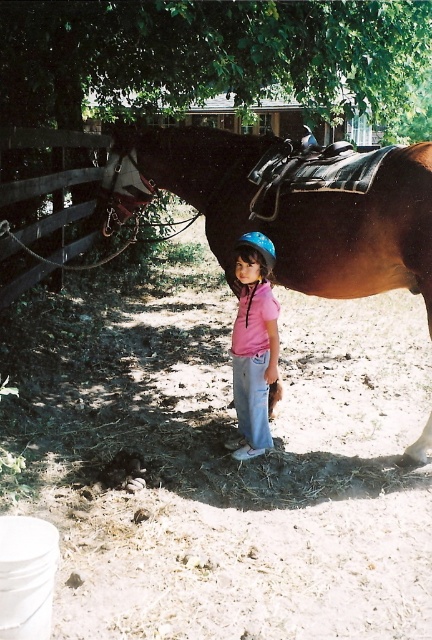
You are a drone operator who needs to capture a photo of the green leafy tree at upper center from the current camera position. What is the approximate distance you need to fly the drone to reach the tree?

The green leafy tree at upper center is approximately 5.80 meters away from the camera, so the drone needs to fly about 5.80 meters to reach it.

You are a parent preparing to secure your child for a horseback riding lesson. You have the brown leather saddle at upper center and the pink matte helmet at center. Which item should you adjust first to ensure safety?

The brown leather saddle at upper center should be adjusted first because it has a larger size compared to the pink matte helmet at center, making it more critical to ensure proper fit for safety.

You are a photographer setting up a shot of the brown wooden fence at left and the blue matte helmet at center. Which object should you focus on first if you want to capture both in the frame without adjusting your camera angle?

The brown wooden fence at left is much taller than the blue matte helmet at center, so you should focus on the brown wooden fence at left first to ensure it fits within the frame.